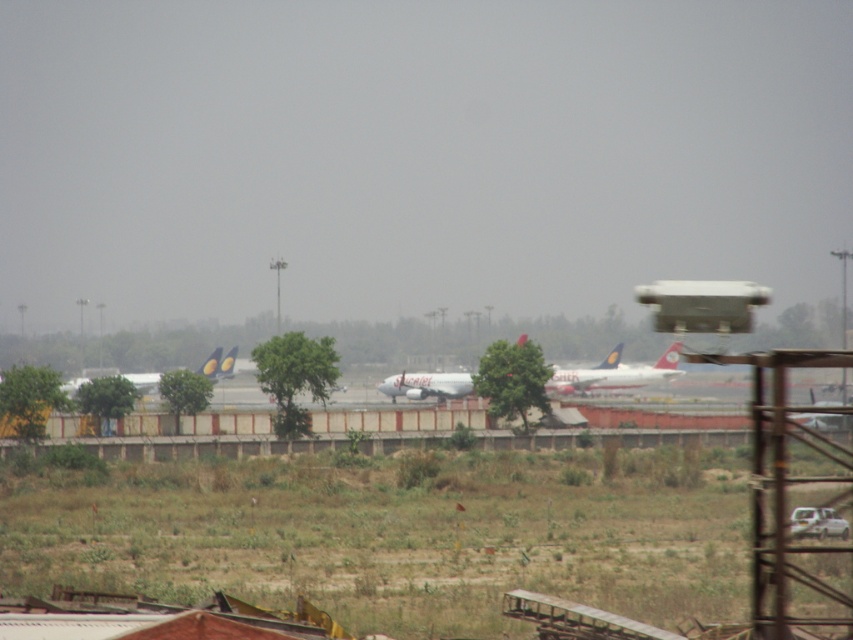
You are standing at the grassy area in the airport scene. There are two points marked on the image. The first point is at coordinates point (660, 378) and the second is at point (218, 352). If you were to walk towards the second point, would you pass by the first point before reaching it?

Point (660, 378) is behind point (218, 352). So, if you walk towards the second point, you would not pass by the first point before reaching it because the first point is located behind the second point in the scene.

You are a maintenance worker at the airport and need to determine which airplane has a wider fuselage between the white glossy airplane at center and the matte yellow airplane at center. Based on the scene, which one is wider?

The matte yellow airplane at center is wider than the white glossy airplane at center.

You are an airport maintenance worker who needs to park a new airplane. You see the white glossy airplane at center and the matte yellow airplane at center. Which airplane takes up more space in the parking area?

The matte yellow airplane at center occupies more space than the white glossy airplane at center, so it takes up more space in the parking area.